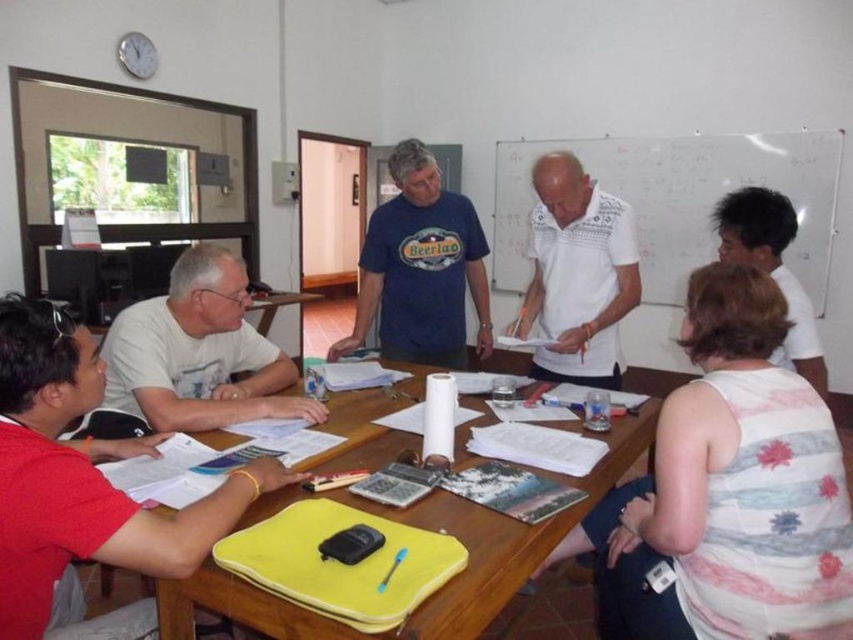
Question: Can you confirm if yellow fabric at center is smaller than white textured shirt at center?

Choices:
 (A) no
 (B) yes

Answer: (A)

Question: Is yellow fabric at center above white textured shirt at center?

Choices:
 (A) yes
 (B) no

Answer: (B)

Question: Which point appears closest to the camera in this image?

Choices:
 (A) click(x=401, y=288)
 (B) click(x=793, y=227)
 (C) click(x=267, y=364)
 (D) click(x=18, y=352)

Answer: (D)

Question: Considering the relative positions of white floral tank top at center and white textured shirt at center in the image provided, where is white floral tank top at center located with respect to white textured shirt at center?

Choices:
 (A) left
 (B) right

Answer: (B)

Question: Which of these objects is positioned closest to the blue cotton t-shirt at center?

Choices:
 (A) white t-shirt at left
 (B) dark brown hair at upper right
 (C) matte red shirt at lower left
 (D) yellow fabric at center

Answer: (D)

Question: Estimate the real-world distances between objects in this image. Which object is farther from the dark brown hair at upper right?

Choices:
 (A) blue cotton t-shirt at center
 (B) white textured shirt at center
 (C) white t-shirt at left

Answer: (C)